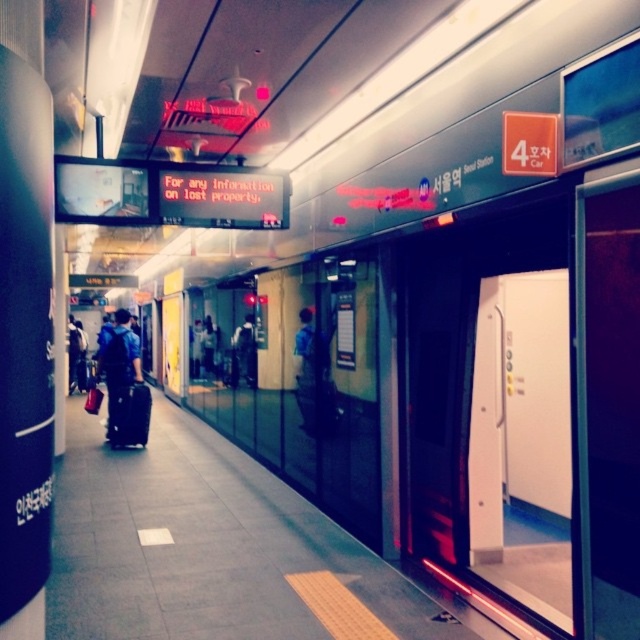
Question: Does blue fabric backpack at center appear over black fabric suitcase at center?

Choices:
 (A) yes
 (B) no

Answer: (A)

Question: Which of the following is the farthest from the observer?

Choices:
 (A) (140, 410)
 (B) (138, 374)

Answer: (B)

Question: Based on their relative distances, which object is nearer to the dark blue backpack at center?

Choices:
 (A) blue fabric backpack at center
 (B) black fabric suitcase at center

Answer: (B)

Question: Is blue fabric backpack at center positioned before black fabric suitcase at center?

Choices:
 (A) no
 (B) yes

Answer: (A)

Question: Estimate the real-world distances between objects in this image. Which object is farther from the blue fabric backpack at center?

Choices:
 (A) dark blue backpack at center
 (B) black fabric suitcase at center

Answer: (A)

Question: Observing the image, what is the correct spatial positioning of black fabric suitcase at center in reference to dark blue backpack at center?

Choices:
 (A) left
 (B) right

Answer: (A)